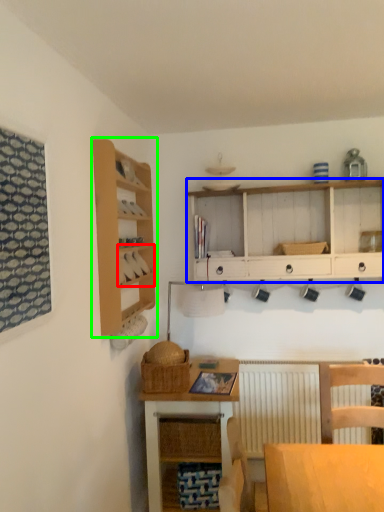
Question: Which object is positioned farthest from cabinet (highlighted by a red box)? Select from cabinetry (highlighted by a blue box) and shelf (highlighted by a green box).

Choices:
 (A) cabinetry
 (B) shelf

Answer: (A)